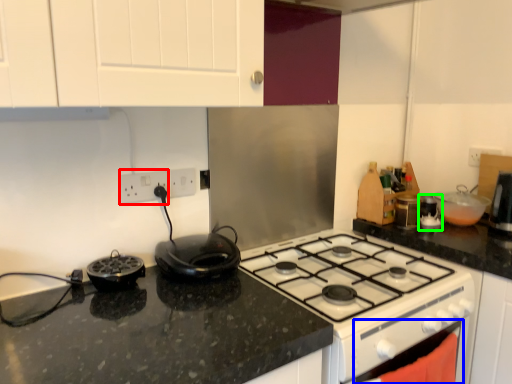
Question: Based on their relative distances, which object is nearer to electric outlet (highlighted by a red box)? Choose from oven (highlighted by a blue box) and appliance (highlighted by a green box).

Choices:
 (A) oven
 (B) appliance

Answer: (A)